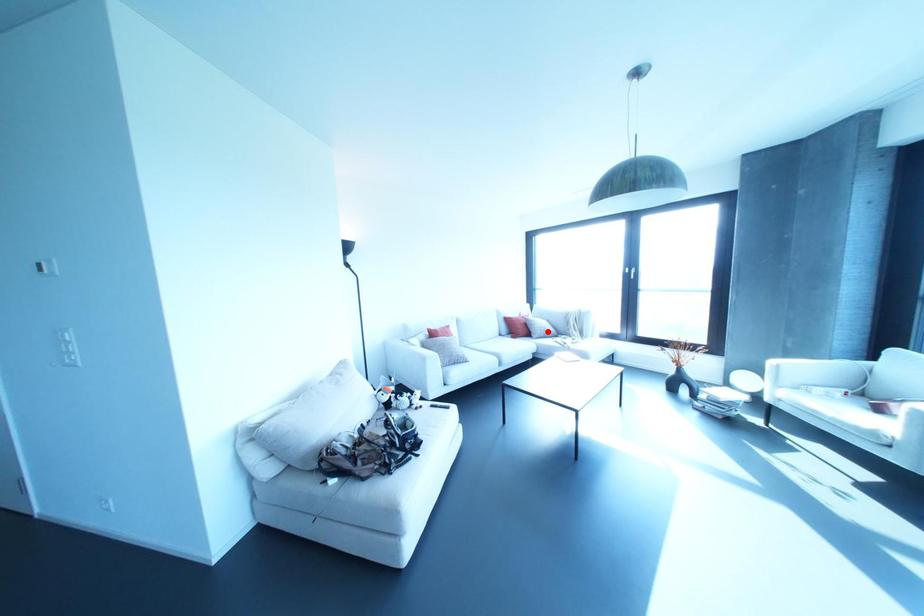
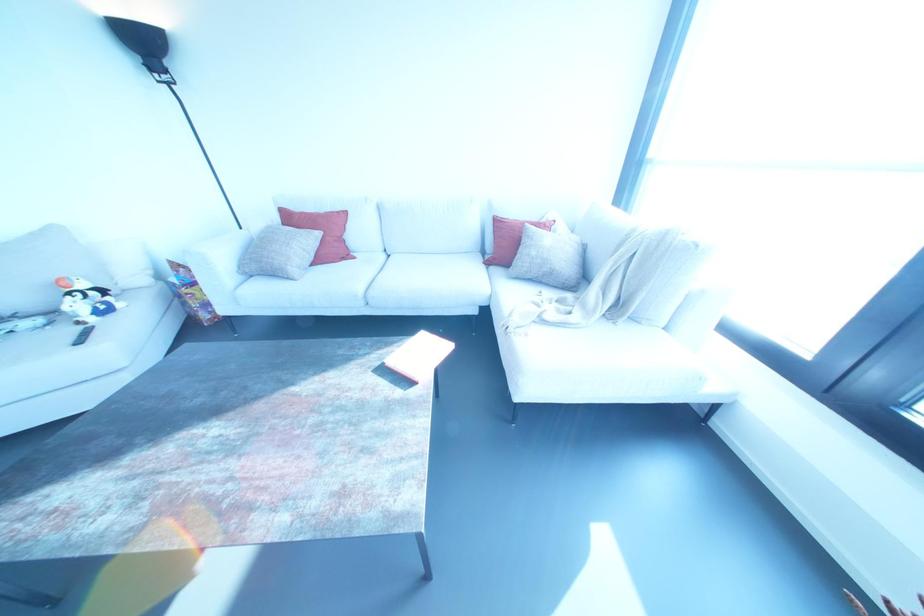
Where in the second image is the point corresponding to the highlighted location from the first image?

(551, 273)